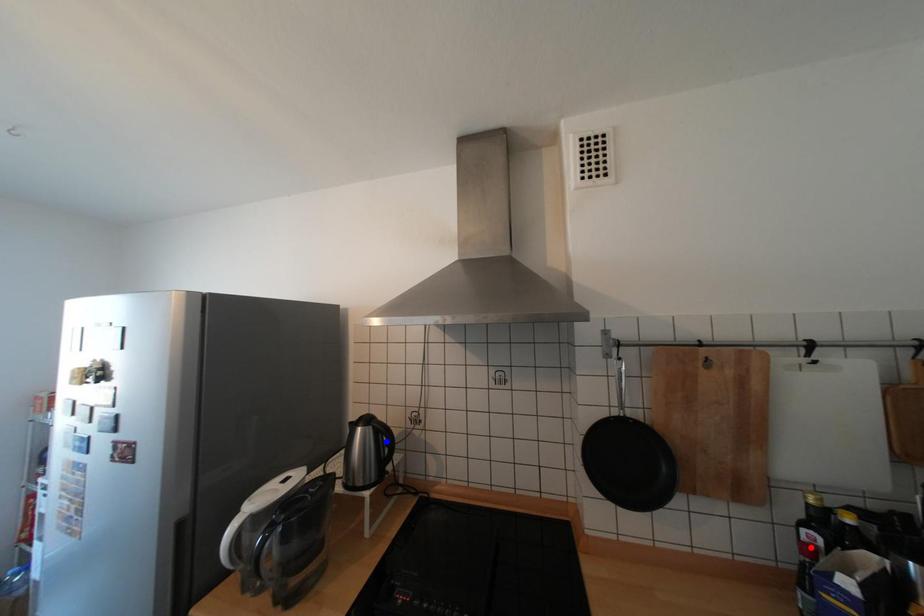
Question: In the image, two points are highlighted. Which point is nearer to the camera? Reply with the corresponding letter.

Choices:
 (A) blue point
 (B) red point

Answer: (B)